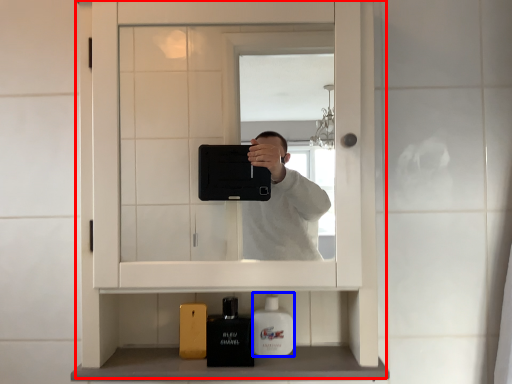
Question: Among these objects, which one is farthest to the camera, medicine cabinet (highlighted by a red box) or mouthwash (highlighted by a blue box)?

Choices:
 (A) medicine cabinet
 (B) mouthwash

Answer: (B)